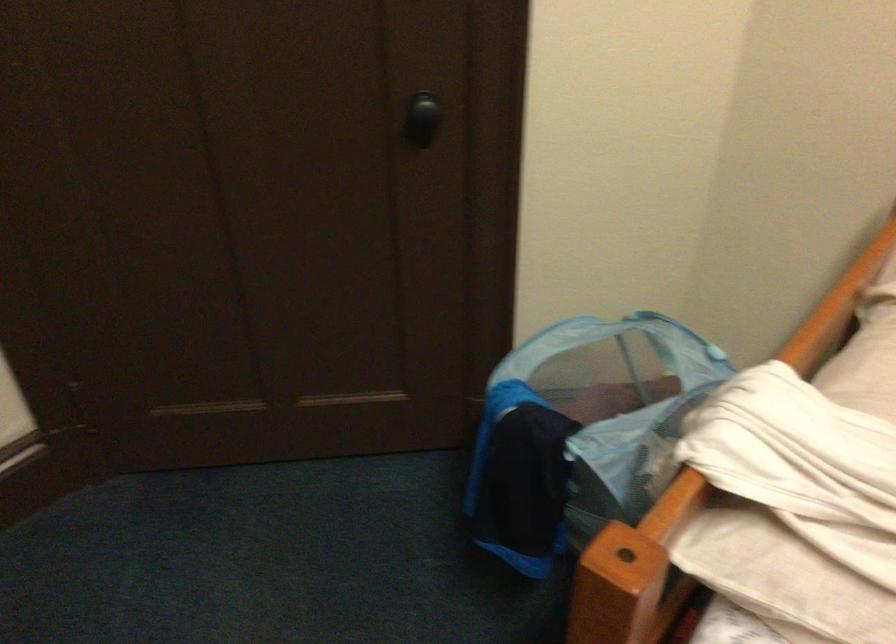
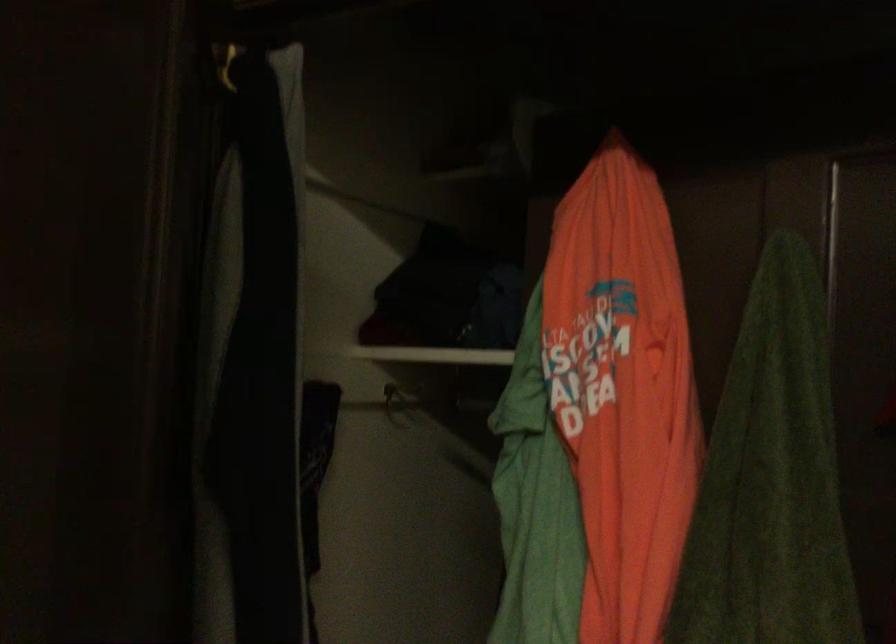
Question: The first image is from the beginning of the video and the second image is from the end. How did the camera likely rotate when shooting the video?

Choices:
 (A) Left
 (B) Right
 (C) Up
 (D) Down

Answer: (A)